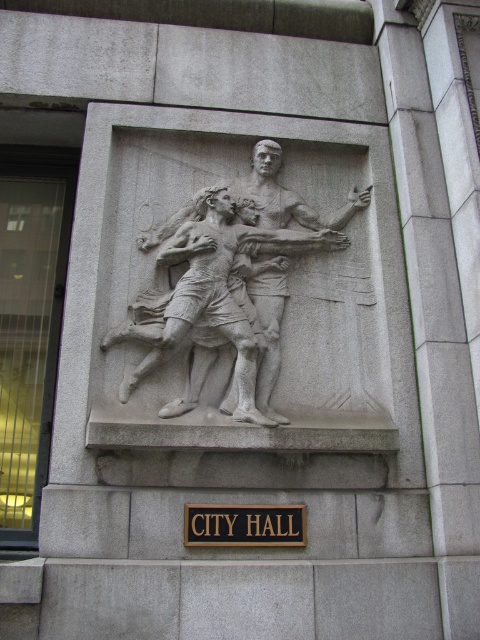
What is located at the coordinates point (228, 285) in the image?

The gray stone relief at center is located at point (228, 285).

You are standing in front of the CITY HALL building and want to take a photo of the gray stone relief at center. If your camera can focus on objects up to 7 meters away, will you be able to capture the relief clearly?

The gray stone relief at center is 6.74 meters away from the camera, which is within the camera maximum focus range of 7 meters. Therefore, you can capture the relief clearly.

You are a photographer trying to capture the entire gray stone relief at center and the black wood sign at center in one frame. Based on their sizes, do you think both can fit in the same shot without cropping?

The gray stone relief at center might be wider than black wood sign at center, so it depends on the camera angle and distance. Adjust your position to ensure both fit within the frame.